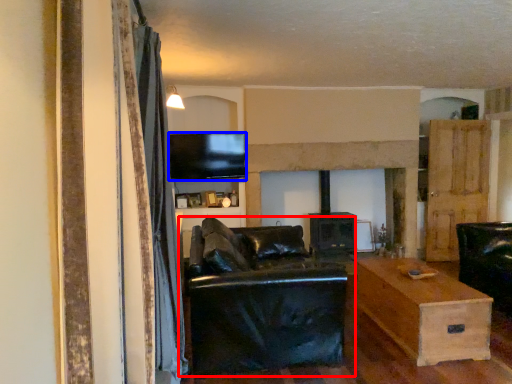
Question: Among these objects, which one is nearest to the camera, studio couch (highlighted by a red box) or television (highlighted by a blue box)?

Choices:
 (A) studio couch
 (B) television

Answer: (A)